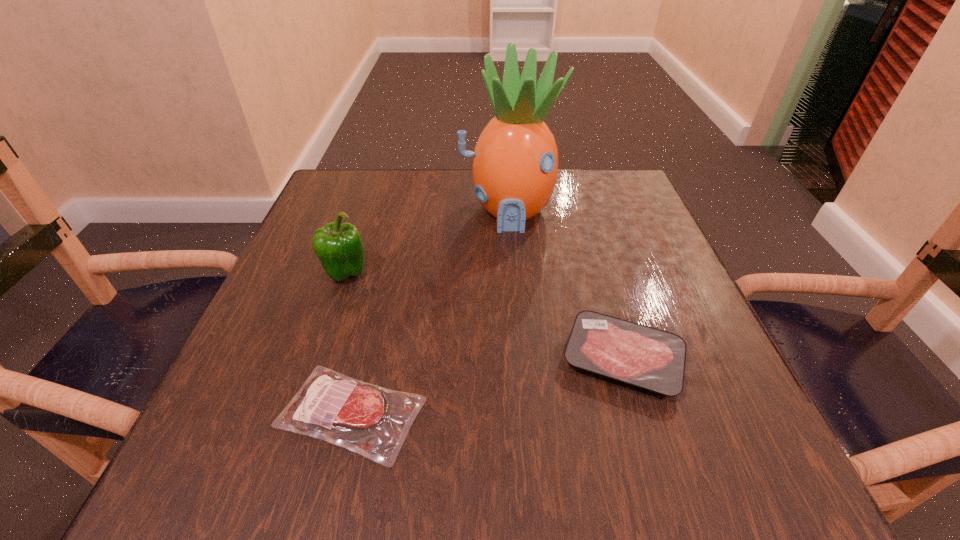
Identify the location of the farthest object. (514, 168).

Image resolution: width=960 pixels, height=540 pixels. What are the coordinates of `pineapple` in the screenshot? It's located at (514, 168).

You are a GUI agent. You are given a task and a screenshot of the screen. Output one action in this format:
    pyautogui.click(x=<x>, y=<y>)
    Task: Click on the second farthest object
    The height and width of the screenshot is (540, 960).
    Given the screenshot: What is the action you would take?
    pyautogui.click(x=339, y=247)

This screenshot has height=540, width=960. What are the coordinates of `the third shortest object` in the screenshot? It's located at (339, 247).

You are a GUI agent. You are given a task and a screenshot of the screen. Output one action in this format:
    pyautogui.click(x=<x>, y=<y>)
    Task: Click on the right steak
    This screenshot has width=960, height=540.
    Given the screenshot: What is the action you would take?
    pyautogui.click(x=648, y=358)

Where is `the left steak`? Image resolution: width=960 pixels, height=540 pixels. the left steak is located at coordinates (373, 421).

Where is `vacant space located 0.320m at the entrance of the pineapple`? vacant space located 0.320m at the entrance of the pineapple is located at coordinates (520, 358).

In order to click on vacant space situated on the right of the second tallest object in this screenshot , I will do `click(445, 273)`.

You are a GUI agent. You are given a task and a screenshot of the screen. Output one action in this format:
    pyautogui.click(x=<x>, y=<y>)
    Task: Click on the vacant space located on the left of the right steak
    
    Given the screenshot: What is the action you would take?
    pyautogui.click(x=448, y=359)

In order to click on blank area located on the right of the left steak in this screenshot , I will do `click(495, 413)`.